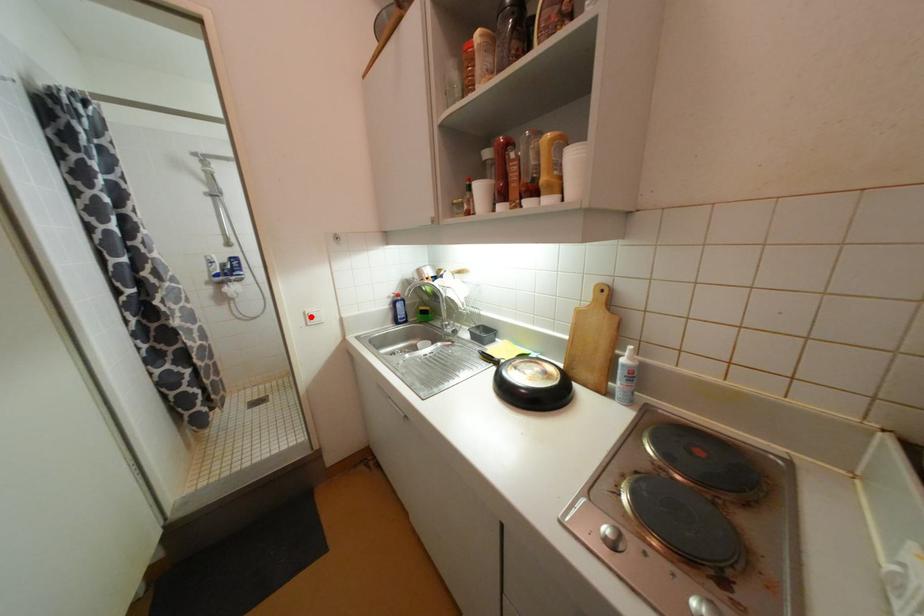
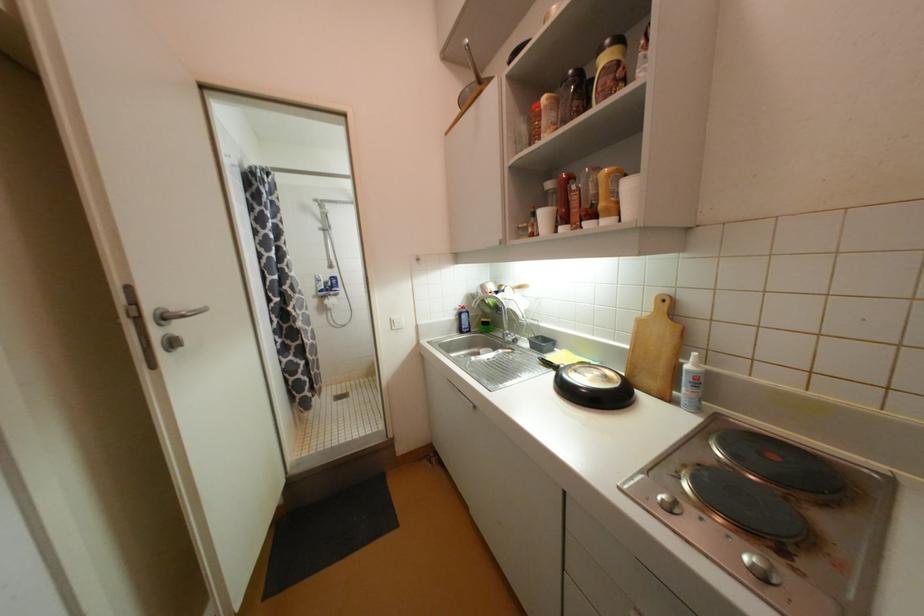
The point at the highlighted location is marked in the first image. Where is the corresponding point in the second image?

(396, 323)